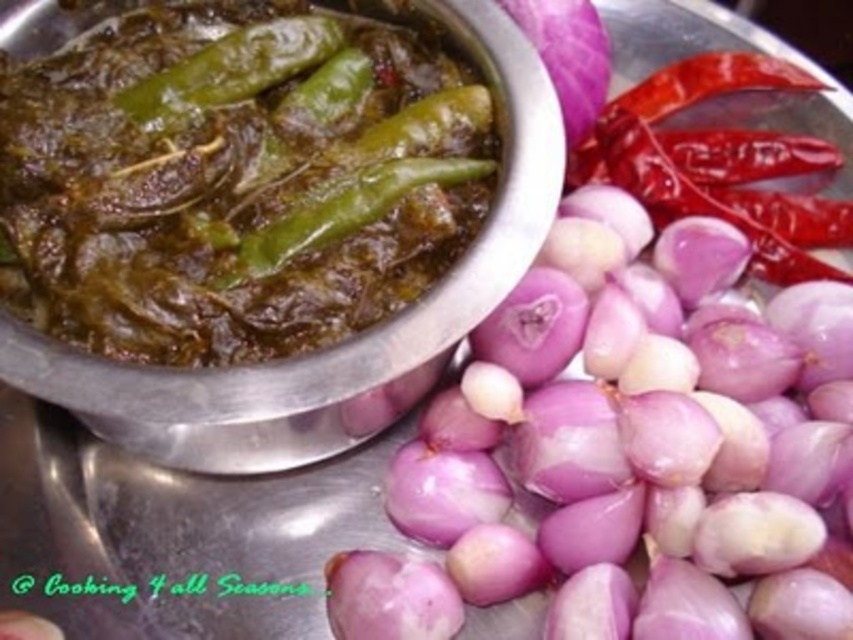
Question: In this image, where is green matte chili pepper at center located relative to red matte chili pepper at upper right?

Choices:
 (A) right
 (B) left

Answer: (B)

Question: Which point is farther to the camera?

Choices:
 (A) red matte chili pepper at upper right
 (B) green matte chili pepper at center

Answer: (A)

Question: Can you confirm if green matte chili pepper at center is smaller than red matte chili pepper at upper right?

Choices:
 (A) yes
 (B) no

Answer: (B)

Question: Where is green matte chili pepper at center located in relation to red matte chili pepper at upper right in the image?

Choices:
 (A) left
 (B) right

Answer: (A)